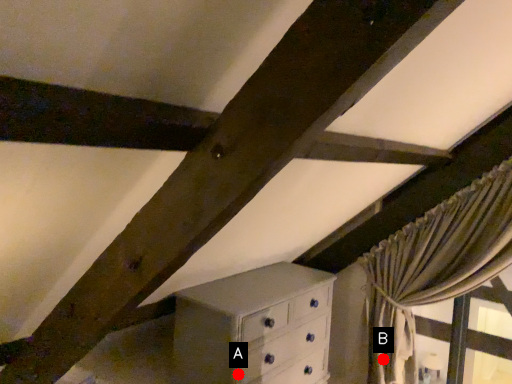
Question: Two points are circled on the image, labeled by A and B beside each circle. Which point is closer to the camera?

Choices:
 (A) A is closer
 (B) B is closer

Answer: (A)